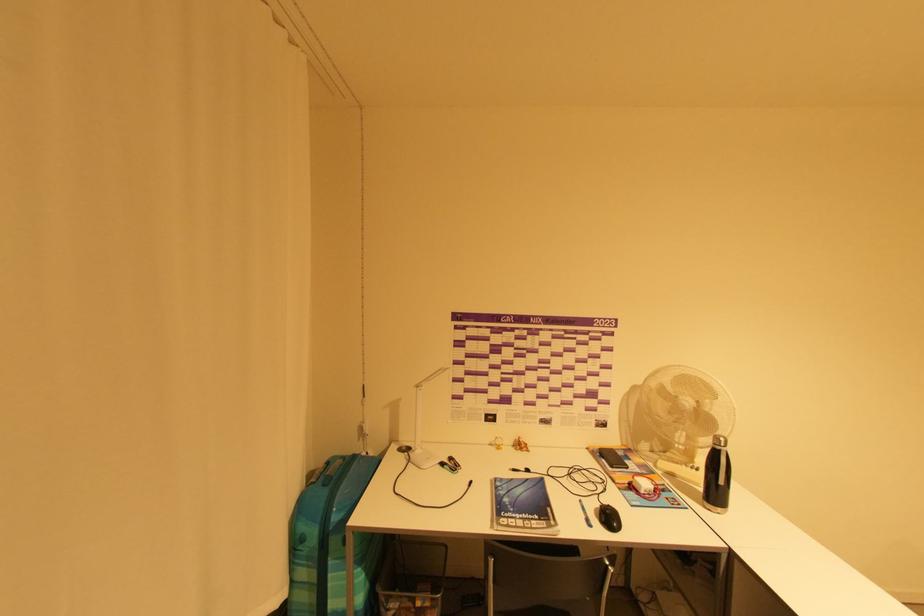
This screenshot has width=924, height=616. Describe the element at coordinates (331, 469) in the screenshot. I see `the suitcase side handle` at that location.